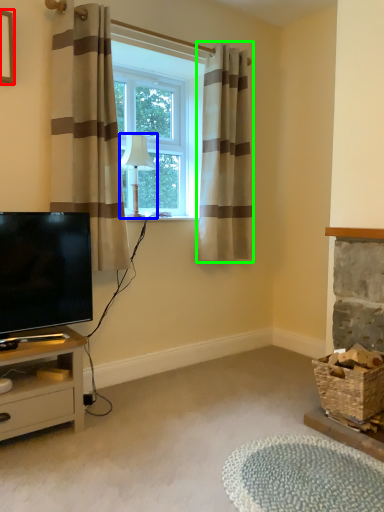
Question: Considering the real-world distances, which object is closest to picture frame (highlighted by a red box)? lamp (highlighted by a blue box) or curtain (highlighted by a green box).

Choices:
 (A) lamp
 (B) curtain

Answer: (A)